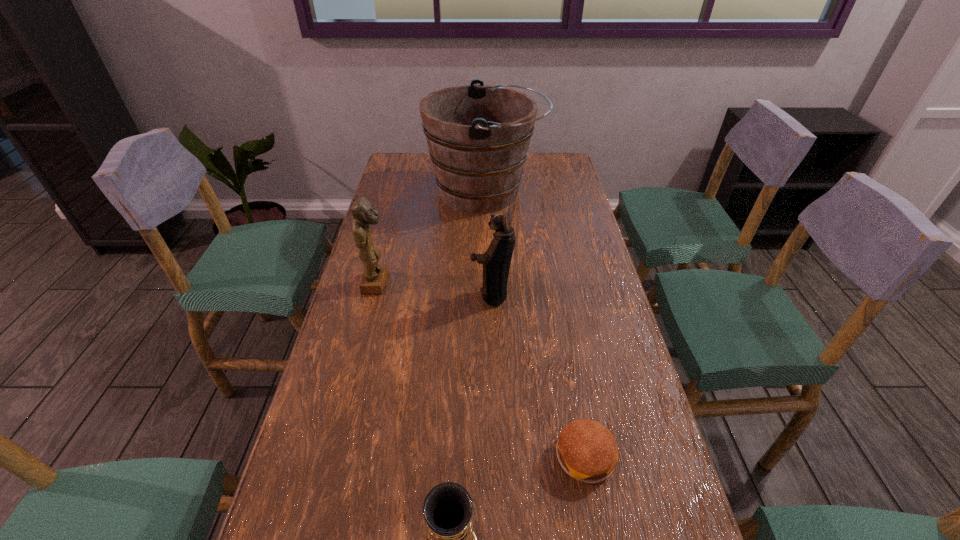
Locate an element on the screen. Image resolution: width=960 pixels, height=540 pixels. vacant space that's between the shortest object and the leftmost object is located at coordinates (482, 370).

This screenshot has width=960, height=540. I want to click on free area in between the leftmost object and the farthest object, so click(x=431, y=238).

In order to click on empty space that is in between the right figurine and the leftmost object in this screenshot , I will do `click(434, 289)`.

The width and height of the screenshot is (960, 540). I want to click on empty location between the shortest object and the tallest object, so click(x=536, y=325).

Find the location of a particular element. The height and width of the screenshot is (540, 960). free space between the leftmost object and the right figurine is located at coordinates (434, 289).

At what (x,y) coordinates should I click in order to perform the action: click on free space between the leftmost object and the hamburger. Please return your answer as a coordinate pair (x, y). Looking at the image, I should click on (482, 370).

I want to click on empty space that is in between the tallest object and the leftmost object, so click(x=431, y=238).

This screenshot has height=540, width=960. In order to click on free space that is in between the bucket and the fourth farthest object in this screenshot , I will do `click(536, 325)`.

Where is `object that ranks as the third closest to the second shortest object`? object that ranks as the third closest to the second shortest object is located at coordinates (374, 278).

Locate an element on the screen. The height and width of the screenshot is (540, 960). object that stands as the third closest to the right figurine is located at coordinates [587, 451].